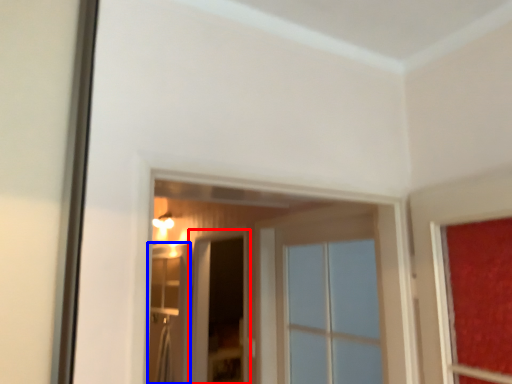
Question: Among these objects, which one is nearest to the camera, screen door (highlighted by a red box) or screen door (highlighted by a blue box)?

Choices:
 (A) screen door
 (B) screen door

Answer: (A)